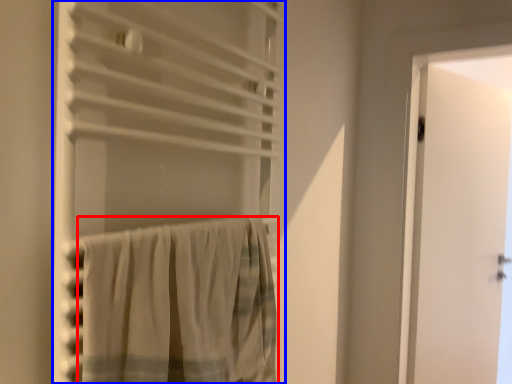
Question: Which point is closer to the camera, curtain (highlighted by a red box) or curtain (highlighted by a blue box)?

Choices:
 (A) curtain
 (B) curtain

Answer: (B)